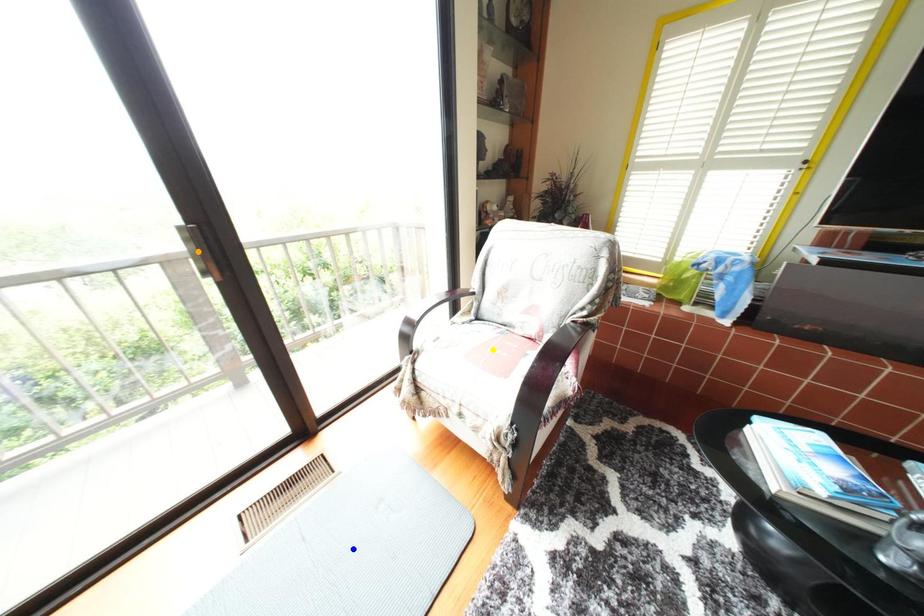
Order these from nearest to farthest:
blue point | orange point | yellow point

orange point, blue point, yellow point